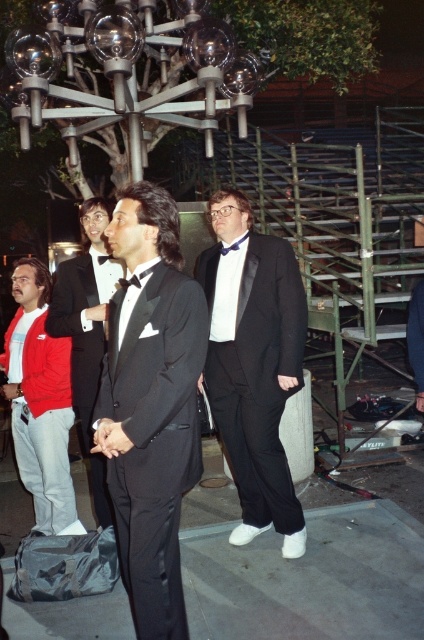
You are a photographer at a formal event. You want to capture a photo that includes both the black satin tuxedo at center and the matte black suit at center. The camera you are using has a maximum focus range of 3 feet. Will both subjects be in focus if they are positioned at their current distance apart?

The distance between the black satin tuxedo at center and the matte black suit at center is 3.31 feet. Since the camera can only focus up to 3 feet, the subjects are slightly out of the focus range. Therefore, they might not both be in focus at the same time.

You are a photographer at the event and need to position your camera to capture the matte black suit at center. What are the coordinates where you should aim your camera?

The coordinates to aim the camera are at point (253,364) to capture the matte black suit at center.

Based on the photo, you are standing in front of the group of formally dressed individuals under the chandelier. There are two points marked in the image. Which point is closer to you, point (x=127, y=371) or point (x=27, y=422)?

Point (x=127, y=371) is closer to the viewer than point (x=27, y=422).